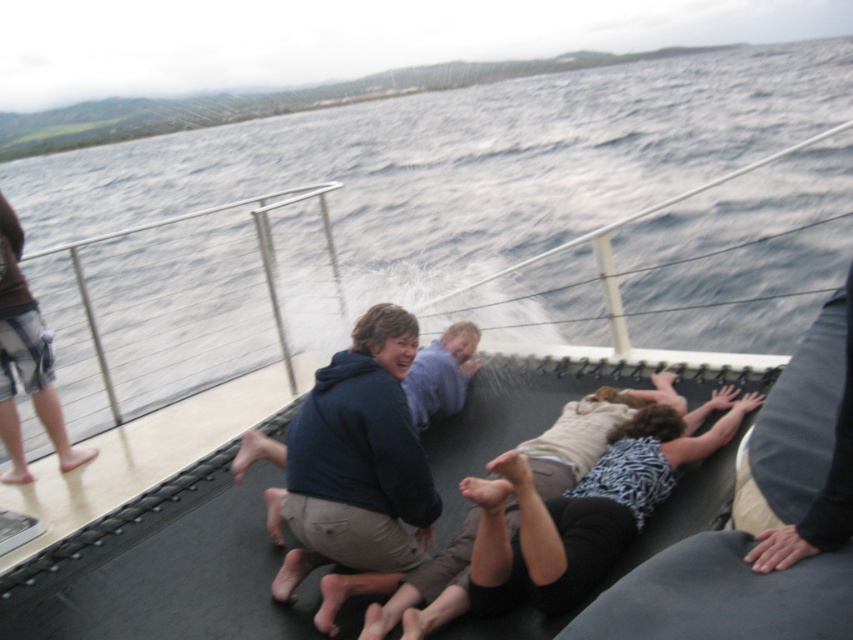
You are standing on the deck of the boat and want to pick up two items located at point (x=605, y=464) and point (x=430, y=364). Which item will require you to move further away from the camera to reach it?

The item at point (x=430, y=364) requires moving further away from the camera because point (x=605, y=464) is closer to the camera than point (x=430, y=364).

In the scene shown: You are a photographer on the boat deck and want to capture both the brown denim shorts at left and the light purple hoodie at center in a single frame. Which object should you focus on first to ensure both are in the shot?

You should focus on the brown denim shorts at left first because it is larger in size than the light purple hoodie at center, ensuring it fits within the frame while the smaller hoodie will naturally be included.